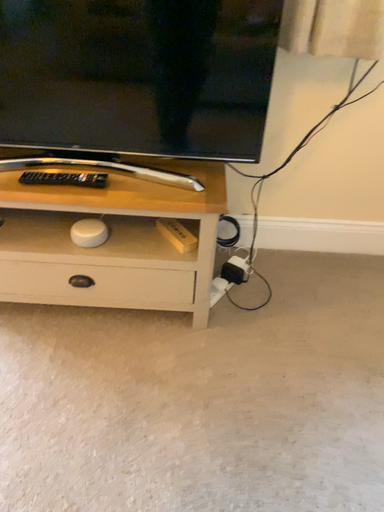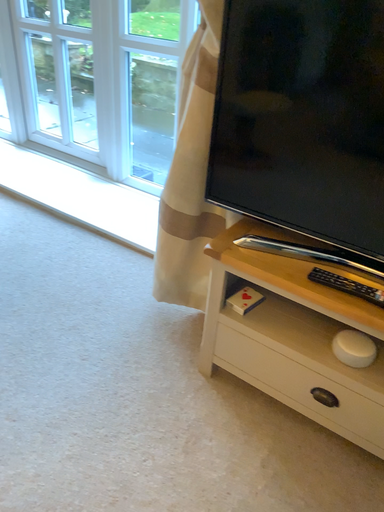
Question: Which way did the camera rotate in the video?

Choices:
 (A) rotated downward
 (B) rotated upward

Answer: (B)